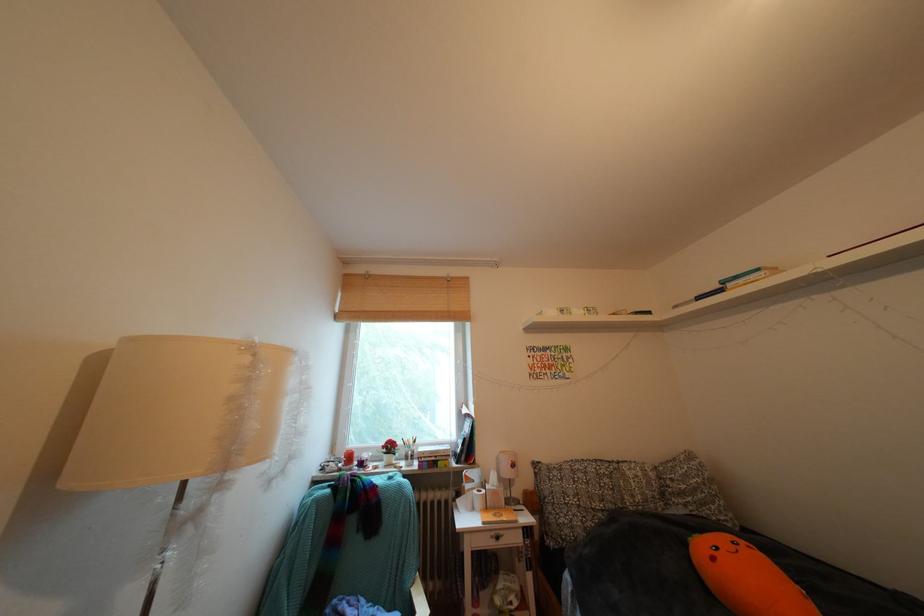
Find where to lift the small white lamp. Please return your answer as a coordinate pair (x, y).

(178, 419)